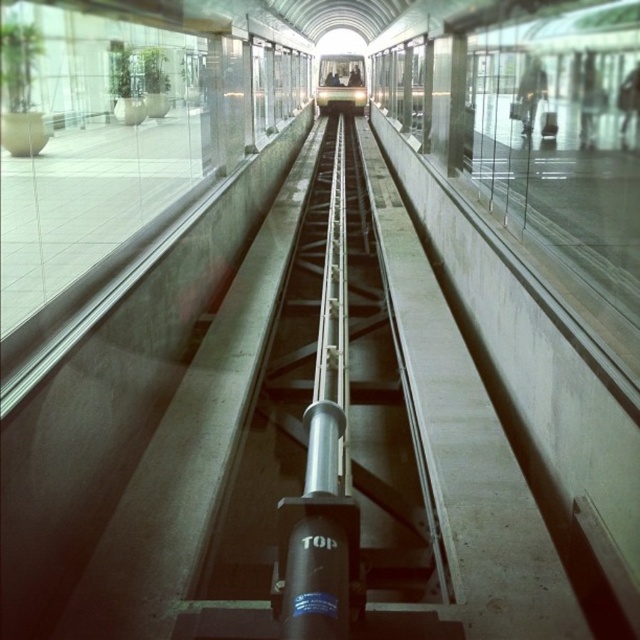
You are a maintenance worker needing to inspect the silver metallic rail at center and the metallic silver train at center. Which object is taller so you can prioritize checking it first?

The silver metallic rail at center is taller than the metallic silver train at center, so you should prioritize checking the silver metallic rail at center first.

You are a passenger waiting to board the metallic silver train at center. You notice the silver metallic rail at center nearby. Which object is bigger in size?

The silver metallic rail at center has a larger size compared to the metallic silver train at center, so the silver metallic rail at center is bigger.